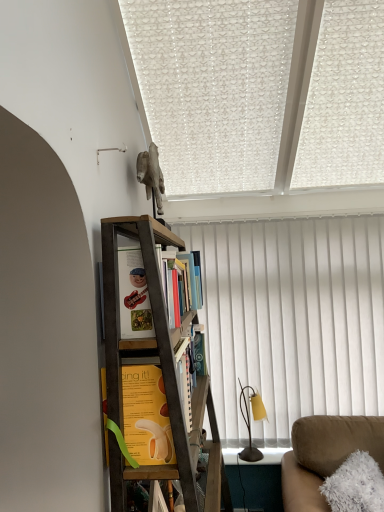
Question: From a real-world perspective, is yellow paper at center, which appears as the first book when viewed from the front, physically located above or below hardcover books at center, marked as the first book in a back-to-front arrangement?

Choices:
 (A) above
 (B) below

Answer: (B)

Question: Is yellow paper at center, which is counted as the second book, starting from the top, situated inside hardcover books at center, placed as the second book when sorted from bottom to top, or outside?

Choices:
 (A) outside
 (B) inside

Answer: (A)

Question: Which object is the closest to the suede couch at lower right?

Choices:
 (A) hardcover books at center, acting as the 2th book starting from the front
 (B) wooden bookcase at center
 (C) wooden bookshelf at upper center
 (D) yellow paper at center, arranged as the first book when ordered from the bottom
 (E) gray stone horse at upper center

Answer: (A)

Question: Which object is the closest to the yellow paper at center, which appears as the first book when viewed from the front?

Choices:
 (A) metallic yellow table lamp at right
 (B) hardcover books at center, marked as the first book in a back-to-front arrangement
 (C) suede couch at lower right
 (D) white textured curtain at center
 (E) gray stone horse at upper center

Answer: (B)